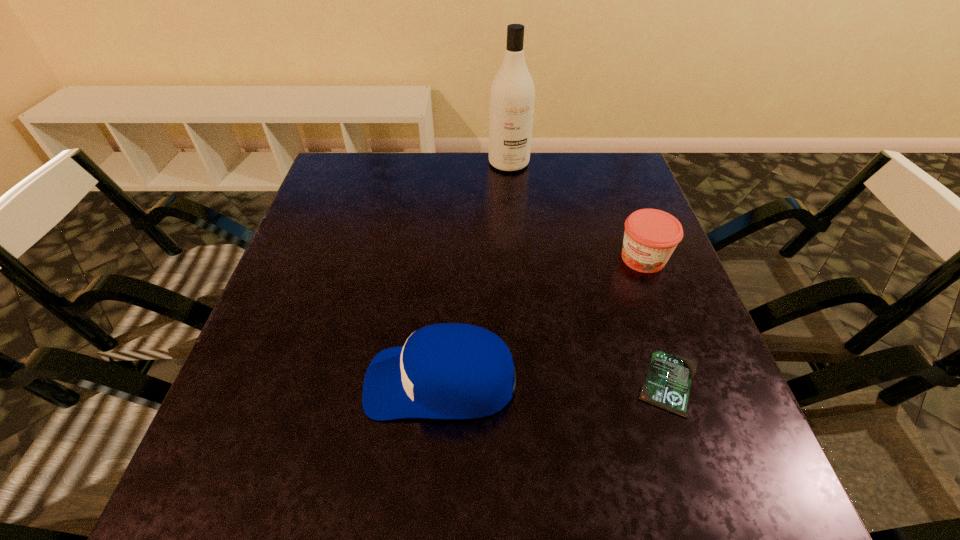
Identify the location of vacant space on the desktop that is between the baseball cap and the identity card and is positioned on the front label of the second farthest object. (540, 382).

Where is `free space on the desktop that is between the baseball cap and the identity card and is positioned on the front-facing side of the shampoo`? Image resolution: width=960 pixels, height=540 pixels. free space on the desktop that is between the baseball cap and the identity card and is positioned on the front-facing side of the shampoo is located at coordinates (581, 382).